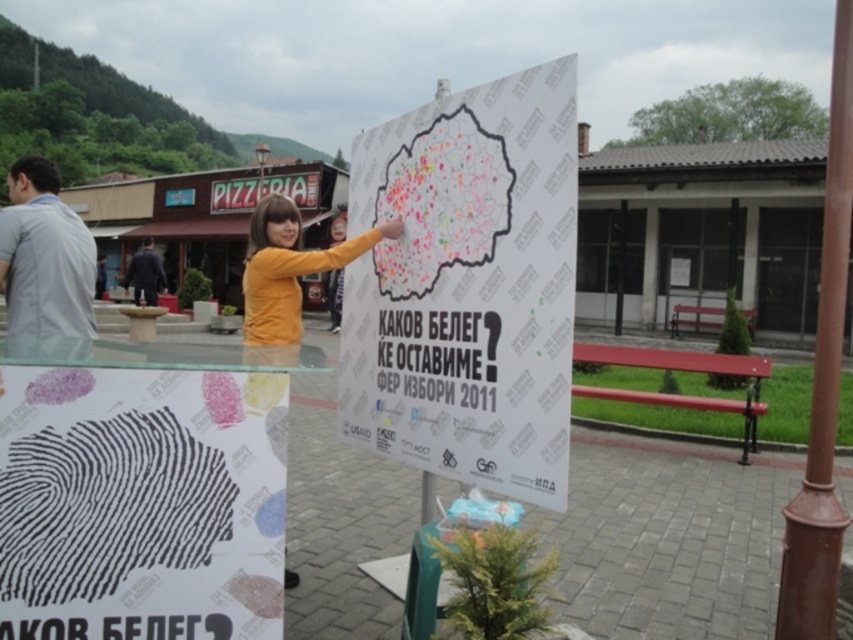
You are a city planner reviewing the outdoor urban setting. You need to determine if the colored paper map at center can be displayed above the gray fabric shirt at left without overlapping. Can it fit vertically?

The colored paper map at center is taller than gray fabric shirt at left, so it can be displayed above without overlapping vertically.

You are a delivery person carrying a box that is 4 feet wide. You need to move from the gray fabric shirt at left to the black fingerprint at center. Is there enough space to pass through without touching either object?

The distance between the black fingerprint at center and gray fabric shirt at left is 5.07 feet. Since the box is 4 feet wide, there is sufficient space to pass through without touching either object.